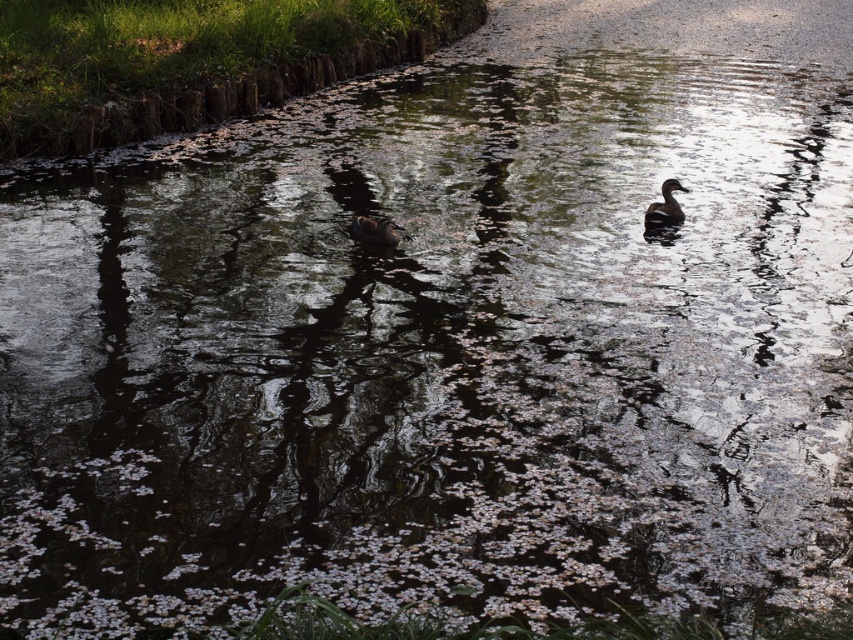
Is dark brown feathers at center shorter than dark brown glossy duck at center?

Indeed, dark brown feathers at center has a lesser height compared to dark brown glossy duck at center.

Is the position of dark brown feathers at center less distant than that of dark brown glossy duck at center?

Yes, it is.

Is point (390, 228) more distant than point (645, 227)?

That is False.

This screenshot has width=853, height=640. Find the location of `dark brown feathers at center`. dark brown feathers at center is located at coordinates (375, 230).